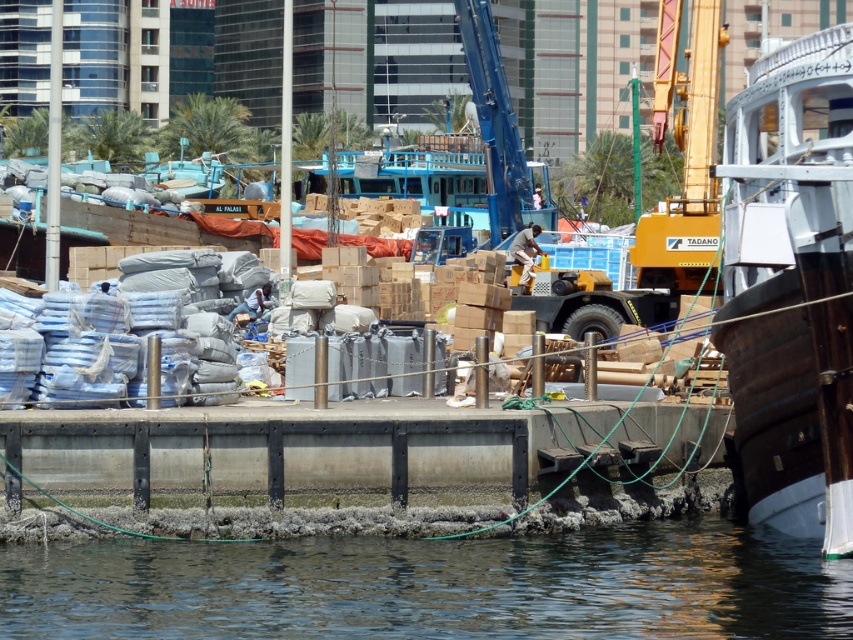
Question: Is wooden boat at right further to camera compared to concrete at center?

Choices:
 (A) no
 (B) yes

Answer: (A)

Question: Which point is closer to the camera?

Choices:
 (A) wooden boat at right
 (B) clear water at lower center

Answer: (B)

Question: Does clear water at lower center have a lesser width compared to wooden boat at right?

Choices:
 (A) yes
 (B) no

Answer: (B)

Question: Is clear water at lower center to the left of wooden boat at right from the viewer's perspective?

Choices:
 (A) yes
 (B) no

Answer: (A)

Question: Which of these objects is positioned closest to the concrete at center?

Choices:
 (A) wooden boat at right
 (B) clear water at lower center

Answer: (B)

Question: Which point is closer to the camera?

Choices:
 (A) wooden boat at right
 (B) concrete at center

Answer: (A)